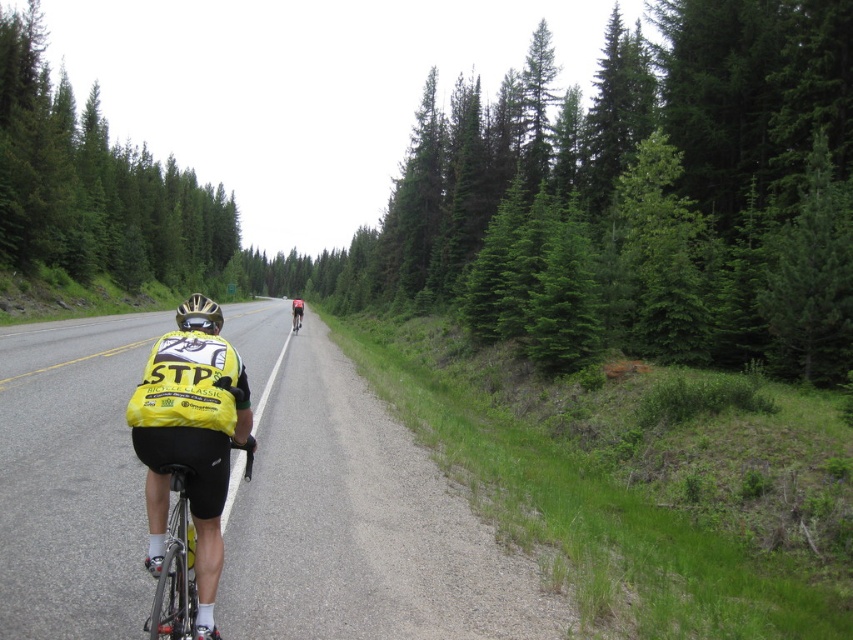
Between point (442, 579) and point (167, 612), which one is positioned behind?

The point (442, 579) is more distant.

Find the location of a particular element. The width and height of the screenshot is (853, 640). smooth asphalt road at center is located at coordinates (354, 513).

Where is `black matte bicycle at center`? black matte bicycle at center is located at coordinates (183, 518).

Who is taller, black matte bicycle at center or red matte bicycle at center?

With more height is red matte bicycle at center.

Between point (167, 467) and point (293, 300), which one is positioned behind?

Point (293, 300)

Locate an element on the screen. This screenshot has width=853, height=640. black matte bicycle at center is located at coordinates (183, 518).

Between point (165, 241) and point (204, 307), which one is positioned behind?

Positioned behind is point (165, 241).

In the scene shown: Can you confirm if green evergreen trees at left is positioned to the left of black matte bicycle helmet at center?

Indeed, green evergreen trees at left is positioned on the left side of black matte bicycle helmet at center.

At what (x,y) coordinates should I click in order to perform the action: click on green evergreen trees at left. Please return your answer as a coordinate pair (x, y). The width and height of the screenshot is (853, 640). Looking at the image, I should click on (93, 182).

Locate an element on the screen. green evergreen trees at left is located at coordinates (93, 182).